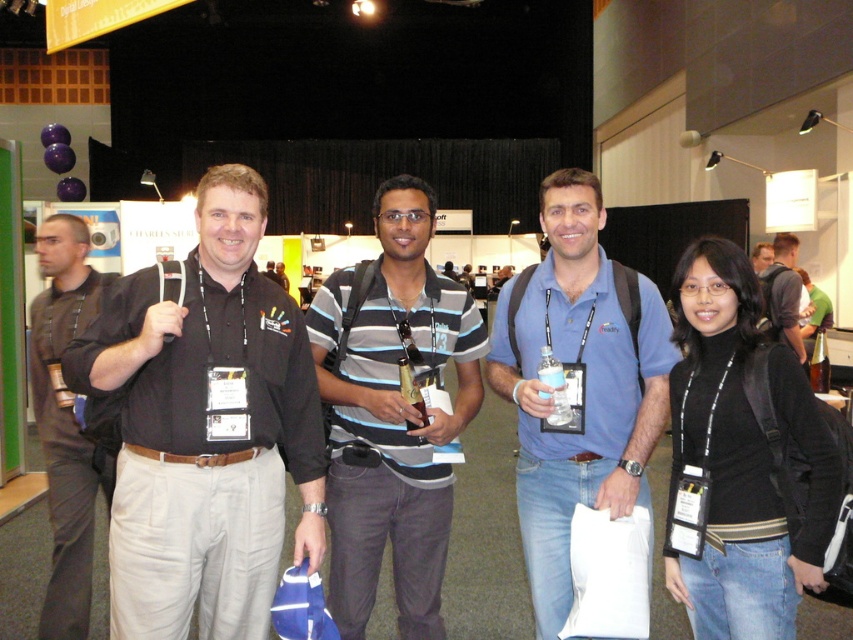
In the scene shown: Which of these two, blue cotton polo shirt at center or black cotton shirt at left, stands shorter?

With less height is blue cotton polo shirt at center.

Is blue cotton polo shirt at center above black cotton shirt at left?

Indeed, blue cotton polo shirt at center is positioned over black cotton shirt at left.

Find the location of a particular element. The image size is (853, 640). blue cotton polo shirt at center is located at coordinates (578, 384).

Which is more to the left, blue cotton polo shirt at center or black matte turtleneck at center?

blue cotton polo shirt at center is more to the left.

Who is taller, blue cotton polo shirt at center or black matte turtleneck at center?

With more height is blue cotton polo shirt at center.

Does point (660, 390) lie behind point (827, 442)?

Yes, point (660, 390) is behind point (827, 442).

At what (x,y) coordinates should I click in order to perform the action: click on blue cotton polo shirt at center. Please return your answer as a coordinate pair (x, y). The width and height of the screenshot is (853, 640). Looking at the image, I should click on (578, 384).

Is black cotton shirt at center to the left of striped cotton shirt at center from the viewer's perspective?

Yes, black cotton shirt at center is to the left of striped cotton shirt at center.

Where is `black cotton shirt at center`? Image resolution: width=853 pixels, height=640 pixels. black cotton shirt at center is located at coordinates point(206,428).

Where is `black cotton shirt at center`? The height and width of the screenshot is (640, 853). black cotton shirt at center is located at coordinates (206, 428).